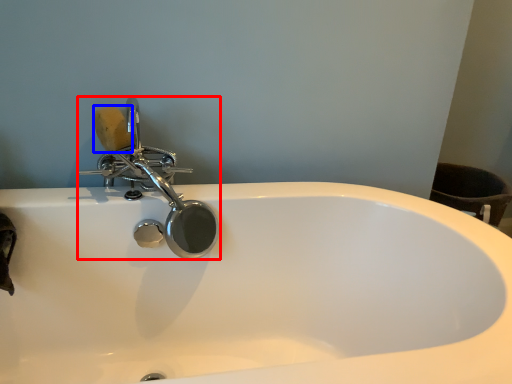
Question: Among these objects, which one is farthest to the camera, tap (highlighted by a red box) or soap (highlighted by a blue box)?

Choices:
 (A) tap
 (B) soap

Answer: (B)